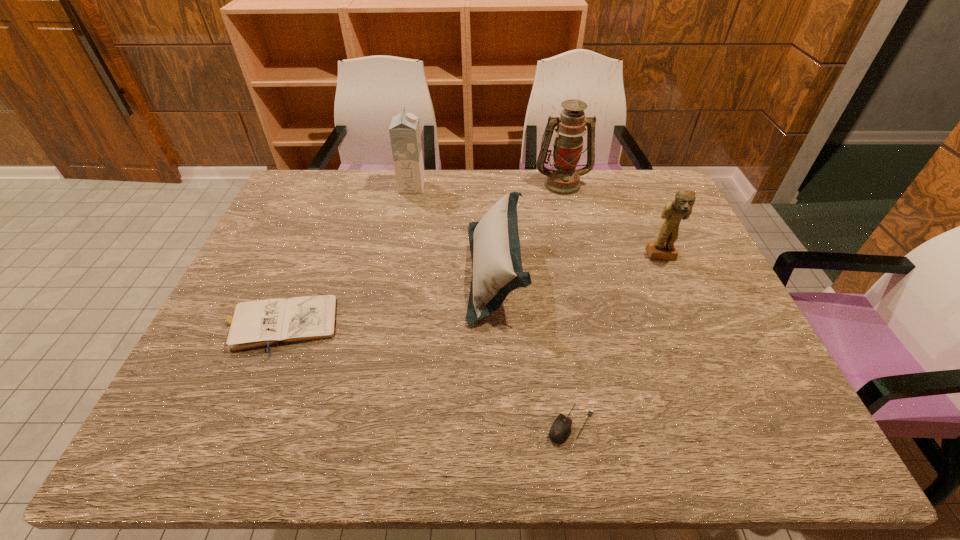
What are the coordinates of `vacant space located 0.240m on the front-facing side of the rightmost object` in the screenshot? It's located at (693, 330).

This screenshot has width=960, height=540. What are the coordinates of `vacant space located on the surface of the third shortest object` in the screenshot? It's located at (449, 272).

Identify the location of blank space located on the surface of the third shortest object. Image resolution: width=960 pixels, height=540 pixels. (392, 272).

The height and width of the screenshot is (540, 960). Find the location of `vacant space located 0.060m on the surface of the third shortest object`. vacant space located 0.060m on the surface of the third shortest object is located at coordinates (445, 272).

Locate an element on the screen. The image size is (960, 540). vacant region located on the right of the notebook is located at coordinates (415, 326).

At what (x,y) coordinates should I click in order to perform the action: click on free space located 0.350m on the back of the nearest object. Please return your answer as a coordinate pair (x, y). Looking at the image, I should click on (550, 285).

Where is `oil lamp that is at the far edge`? oil lamp that is at the far edge is located at coordinates (563, 179).

You are a GUI agent. You are given a task and a screenshot of the screen. Output one action in this format:
    pyautogui.click(x=<x>, y=<y>)
    Task: Click on the carton that is positioned at the far edge
    The height and width of the screenshot is (540, 960).
    Given the screenshot: What is the action you would take?
    pyautogui.click(x=404, y=130)

I want to click on object that is at the near edge, so click(560, 430).

Locate an element on the screen. Image resolution: width=960 pixels, height=540 pixels. object located in the left edge section of the desktop is located at coordinates (254, 324).